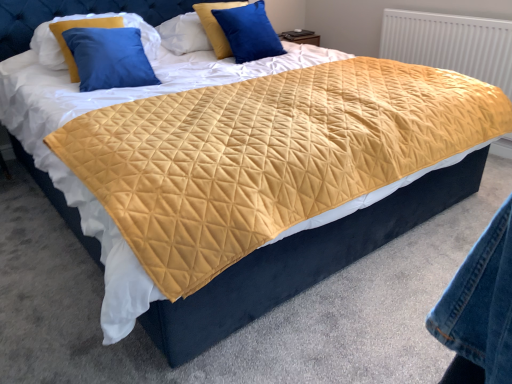
Question: Would you say blue velvet pillow at upper center, arranged as the 3th pillow when viewed from the left, is outside velvet blue pillow at upper left, which ranks as the third pillow in right-to-left order?

Choices:
 (A) no
 (B) yes

Answer: (B)

Question: Can you confirm if blue velvet pillow at upper center, arranged as the 3th pillow when viewed from the left, is bigger than velvet blue pillow at upper left, placed as the first pillow when sorted from left to right?

Choices:
 (A) yes
 (B) no

Answer: (B)

Question: Is velvet blue pillow at upper left, placed as the first pillow when sorted from left to right, at the back of blue velvet pillow at upper center, the 1th pillow positioned from the right?

Choices:
 (A) no
 (B) yes

Answer: (A)

Question: From the image's perspective, is blue velvet pillow at upper center, arranged as the 3th pillow when viewed from the left, over velvet blue pillow at upper left, which ranks as the third pillow in right-to-left order?

Choices:
 (A) yes
 (B) no

Answer: (A)

Question: From a real-world perspective, is blue velvet pillow at upper center, the 1th pillow positioned from the right, positioned over velvet blue pillow at upper left, which ranks as the third pillow in right-to-left order, based on gravity?

Choices:
 (A) no
 (B) yes

Answer: (A)

Question: Does blue velvet pillow at upper center, arranged as the 3th pillow when viewed from the left, have a lesser height compared to velvet blue pillow at upper left, which ranks as the third pillow in right-to-left order?

Choices:
 (A) yes
 (B) no

Answer: (B)

Question: Considering the relative sizes of blue velvet pillow at upper center, the second pillow from the right, and velvet blue pillow at upper left, which ranks as the third pillow in right-to-left order, in the image provided, is blue velvet pillow at upper center, the second pillow from the right, wider than velvet blue pillow at upper left, which ranks as the third pillow in right-to-left order,?

Choices:
 (A) yes
 (B) no

Answer: (B)

Question: Is blue velvet pillow at upper center, the second pillow from the right, at the right side of velvet blue pillow at upper left, which ranks as the third pillow in right-to-left order?

Choices:
 (A) yes
 (B) no

Answer: (A)

Question: Is blue velvet pillow at upper center, positioned as the second pillow in left-to-right order, positioned behind velvet blue pillow at upper left, which ranks as the third pillow in right-to-left order?

Choices:
 (A) yes
 (B) no

Answer: (A)

Question: From the image's perspective, is blue velvet pillow at upper center, positioned as the second pillow in left-to-right order, located above velvet blue pillow at upper left, placed as the first pillow when sorted from left to right?

Choices:
 (A) yes
 (B) no

Answer: (A)

Question: Does blue velvet pillow at upper center, positioned as the second pillow in left-to-right order, have a larger size compared to velvet blue pillow at upper left, placed as the first pillow when sorted from left to right?

Choices:
 (A) no
 (B) yes

Answer: (A)

Question: Is blue velvet pillow at upper center, positioned as the second pillow in left-to-right order, at the left side of velvet blue pillow at upper left, placed as the first pillow when sorted from left to right?

Choices:
 (A) yes
 (B) no

Answer: (B)

Question: Is blue velvet pillow at upper center, arranged as the 3th pillow when viewed from the left, positioned far away from white textured radiator at upper right?

Choices:
 (A) yes
 (B) no

Answer: (A)